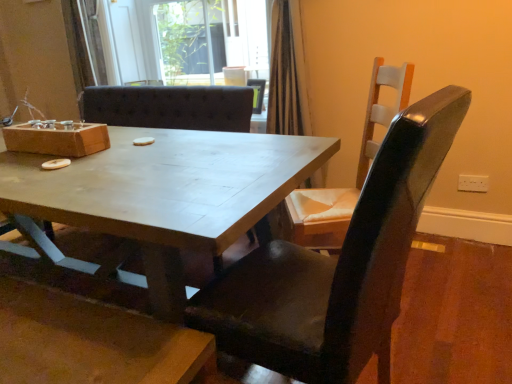
Where is `empty space that is ontop of matte wooden table at center (from a real-world perspective)`? The width and height of the screenshot is (512, 384). empty space that is ontop of matte wooden table at center (from a real-world perspective) is located at coordinates (114, 170).